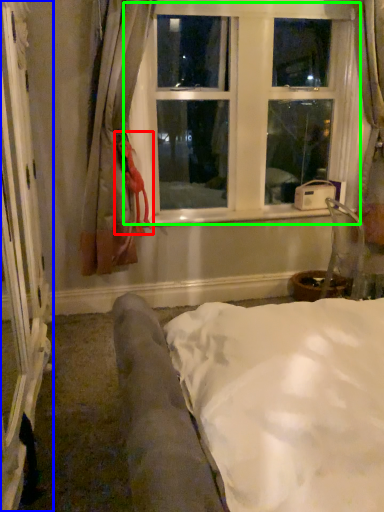
Question: Considering the real-world distances, which object is closest to doll (highlighted by a red box)? screen door (highlighted by a blue box) or window (highlighted by a green box).

Choices:
 (A) screen door
 (B) window

Answer: (B)